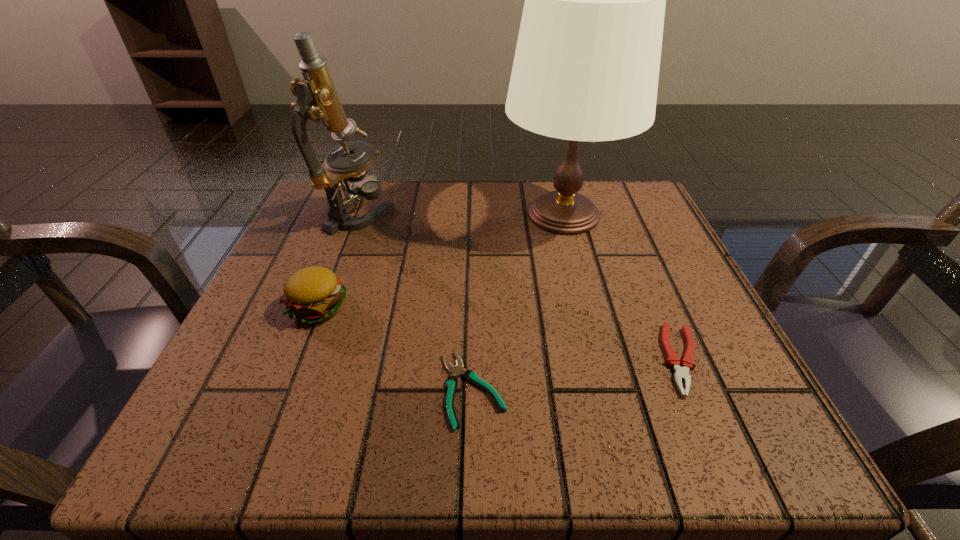
Find the location of a particular element. The width and height of the screenshot is (960, 540). free space in the image that satisfies the following two spatial constraints: 1. on the back side of the hamburger; 2. on the left side of the microscope is located at coordinates (354, 214).

The height and width of the screenshot is (540, 960). Find the location of `blank space that satisfies the following two spatial constraints: 1. on the front side of the lamp; 2. on the left side of the fourth shortest object`. blank space that satisfies the following two spatial constraints: 1. on the front side of the lamp; 2. on the left side of the fourth shortest object is located at coordinates (360, 215).

Find the location of a particular element. Image resolution: width=960 pixels, height=540 pixels. free location that satisfies the following two spatial constraints: 1. on the front side of the microscope; 2. on the left side of the left pliers is located at coordinates (295, 389).

This screenshot has height=540, width=960. In order to click on vacant area that satisfies the following two spatial constraints: 1. on the back side of the lamp; 2. on the left side of the third shortest object in this screenshot , I will do `click(354, 215)`.

This screenshot has width=960, height=540. In order to click on free spot that satisfies the following two spatial constraints: 1. on the front side of the microscope; 2. on the right side of the shorter pliers in this screenshot , I will do `click(295, 389)`.